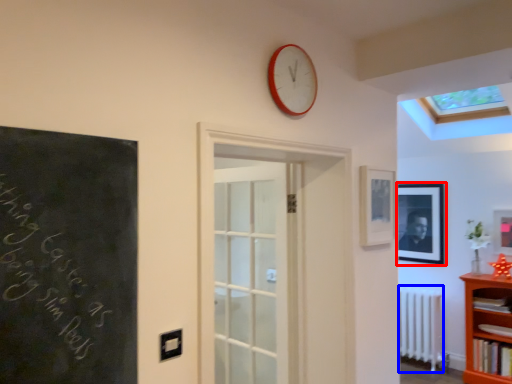
Question: Which of the following is the farthest to the observer, picture frame (highlighted by a red box) or radiator (highlighted by a blue box)?

Choices:
 (A) picture frame
 (B) radiator

Answer: (A)